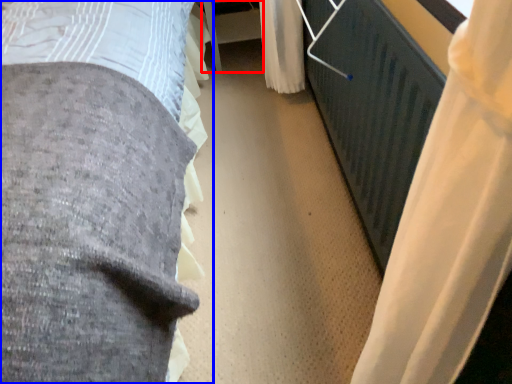
Question: Which object is further to the camera taking this photo, table (highlighted by a red box) or bed (highlighted by a blue box)?

Choices:
 (A) table
 (B) bed

Answer: (A)